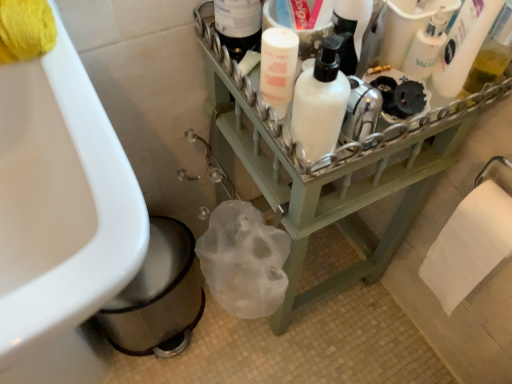
Question: From a real-world perspective, is white matte pump bottle at upper center, the 4th cleaning product when ordered from right to left, physically located above or below white glossy sink at lower left?

Choices:
 (A) above
 (B) below

Answer: (A)

Question: Is white matte pump bottle at upper center, which is the 1th cleaning product in left-to-right order, to the left or to the right of white glossy sink at lower left in the image?

Choices:
 (A) right
 (B) left

Answer: (A)

Question: Which of these objects is positioned closest to the white matte bottle at upper right, which appears as the 3th cleaning product when viewed from the left?

Choices:
 (A) translucent plastic bottle at upper right, the fourth cleaning product when ordered from left to right
 (B) white matte bottle at upper center
 (C) white paper towel at lower right, which ranks as the second toilet paper in left-to-right order
 (D) white matte bottle at upper center, arranged as the second cleaning product when viewed from the left
 (E) green wood shelf at center

Answer: (A)

Question: Considering the real-world distances, which object is closest to the white matte pump bottle at upper center, which is the 1th cleaning product in left-to-right order?

Choices:
 (A) white matte bottle at upper center
 (B) translucent plastic bottle at upper right, the fourth cleaning product when ordered from left to right
 (C) white matte bottle at upper right, which appears as the 3th cleaning product when viewed from the left
 (D) green wood shelf at center
 (E) white matte bottle at upper center, which ranks as the third cleaning product in right-to-left order

Answer: (E)